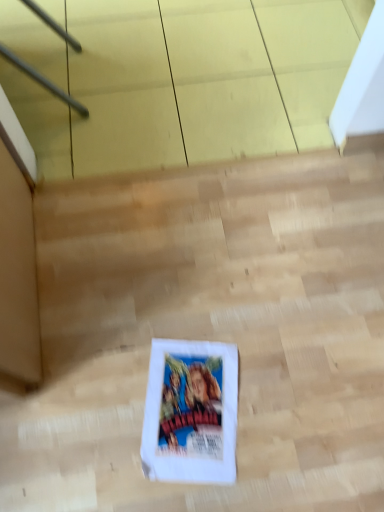
You are a GUI agent. You are given a task and a screenshot of the screen. Output one action in this format:
    pyautogui.click(x=<x>, y=<y>)
    Task: Click on the white paper comic book at center
    
    Given the screenshot: What is the action you would take?
    pyautogui.click(x=191, y=412)

What do you see at coordinates (191, 412) in the screenshot?
I see `white paper comic book at center` at bounding box center [191, 412].

What is the approximate width of white paper bag at center?

It is 93.54 centimeters.

Describe the element at coordinates (209, 333) in the screenshot. This screenshot has width=384, height=512. I see `white paper bag at center` at that location.

Locate an element on the screen. The height and width of the screenshot is (512, 384). white paper bag at center is located at coordinates (209, 333).

Find the location of a particular element. white paper comic book at center is located at coordinates (191, 412).

Which is more to the right, white paper bag at center or white paper comic book at center?

From the viewer's perspective, white paper bag at center appears more on the right side.

In the image, is white paper bag at center positioned in front of or behind white paper comic book at center?

Clearly, white paper bag at center is in front of white paper comic book at center.

Between point (308, 507) and point (163, 436), which one is positioned in front?

Positioned in front is point (308, 507).

From the image's perspective, which is below, white paper bag at center or white paper comic book at center?

white paper comic book at center is shown below in the image.

From a real-world perspective, does white paper bag at center stand above white paper comic book at center?

Indeed, from a real-world perspective, white paper bag at center stands above white paper comic book at center.

Based on the photo, considering the sizes of white paper bag at center and white paper comic book at center in the image, is white paper bag at center wider or thinner than white paper comic book at center?

In the image, white paper bag at center appears to be wider than white paper comic book at center.

Does white paper bag at center have a lesser height compared to white paper comic book at center?

Incorrect, the height of white paper bag at center does not fall short of that of white paper comic book at center.

Who is bigger, white paper bag at center or white paper comic book at center?

Bigger between the two is white paper bag at center.

Is white paper bag at center inside or outside of white paper comic book at center?

The correct answer is: outside.

Is white paper bag at center positioned far away from white paper comic book at center?

white paper bag at center is near white paper comic book at center, not far away.

Is white paper bag at center positioned with its back to white paper comic book at center?

Correct, white paper bag at center is looking away from white paper comic book at center.

Find the location of a particular element. The width and height of the screenshot is (384, 512). comic book behind the white paper bag at center is located at coordinates (191, 412).

Considering the positions of objects white paper comic book at center and white paper bag at center in the image provided, who is more to the left, white paper comic book at center or white paper bag at center?

Positioned to the left is white paper comic book at center.

Is white paper comic book at center in front of or behind white paper bag at center in the image?

white paper comic book at center is positioned farther from the viewer than white paper bag at center.

Does point (196, 477) appear closer or farther from the camera than point (346, 373)?

Point (196, 477) is closer to the camera than point (346, 373).

From the image's perspective, is white paper comic book at center positioned above or below white paper bag at center?

Clearly, from the image's perspective, white paper comic book at center is below white paper bag at center.

From a real-world perspective, is white paper comic book at center positioned above or below white paper bag at center?

white paper comic book at center is below white paper bag at center.

Can you confirm if white paper comic book at center is thinner than white paper bag at center?

Correct, the width of white paper comic book at center is less than that of white paper bag at center.

Considering the sizes of objects white paper comic book at center and white paper bag at center in the image provided, who is taller, white paper comic book at center or white paper bag at center?

With more height is white paper bag at center.

Can you confirm if white paper comic book at center is smaller than white paper bag at center?

Yes, white paper comic book at center is smaller than white paper bag at center.

Can we say white paper comic book at center lies outside white paper bag at center?

Actually, white paper comic book at center is within white paper bag at center.

Are white paper comic book at center and white paper bag at center making contact?

white paper comic book at center is not next to white paper bag at center, and they're not touching.

Is white paper comic book at center facing towards white paper bag at center?

Yes.

The height and width of the screenshot is (512, 384). Find the location of `comic book located on the left of white paper bag at center`. comic book located on the left of white paper bag at center is located at coordinates (191, 412).

The width and height of the screenshot is (384, 512). I want to click on stairwell above the white paper comic book at center (from a real-world perspective), so click(209, 333).

Locate an element on the screen. Image resolution: width=384 pixels, height=512 pixels. comic book on the left side of white paper bag at center is located at coordinates (191, 412).